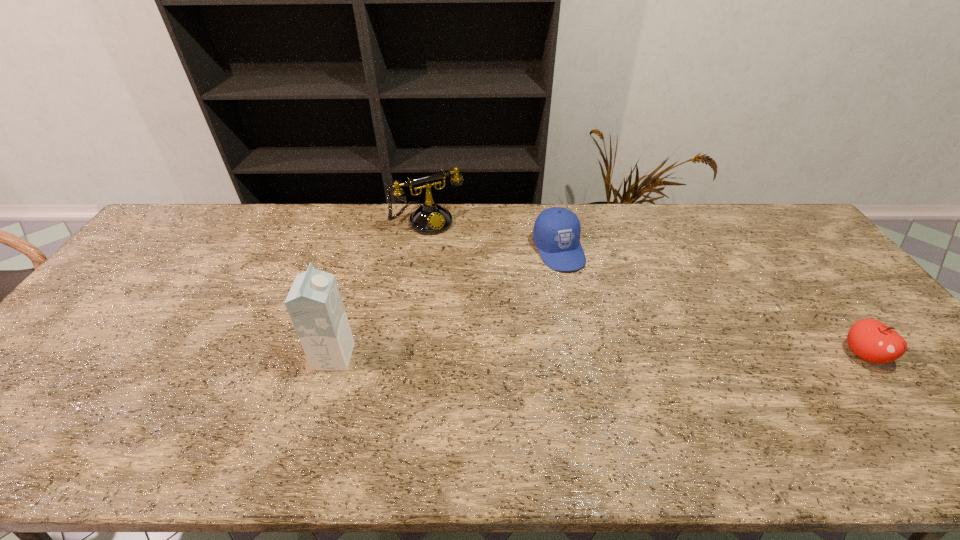
Locate an element on the screen. vacant spot on the desktop that is between the tallest object and the rightmost object and is positioned on the front-facing side of the cap is located at coordinates (621, 355).

What are the coordinates of `vacant spot on the desktop that is between the leftmost object and the apple and is positioned on the dial of the telephone` in the screenshot? It's located at [523, 356].